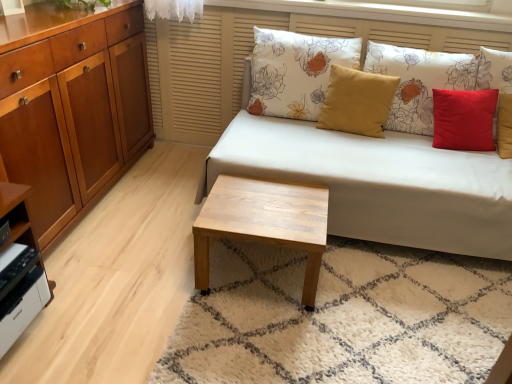
Where is `vacant area that lies to the right of light wood/texture coffee table at center`? vacant area that lies to the right of light wood/texture coffee table at center is located at coordinates [x=362, y=286].